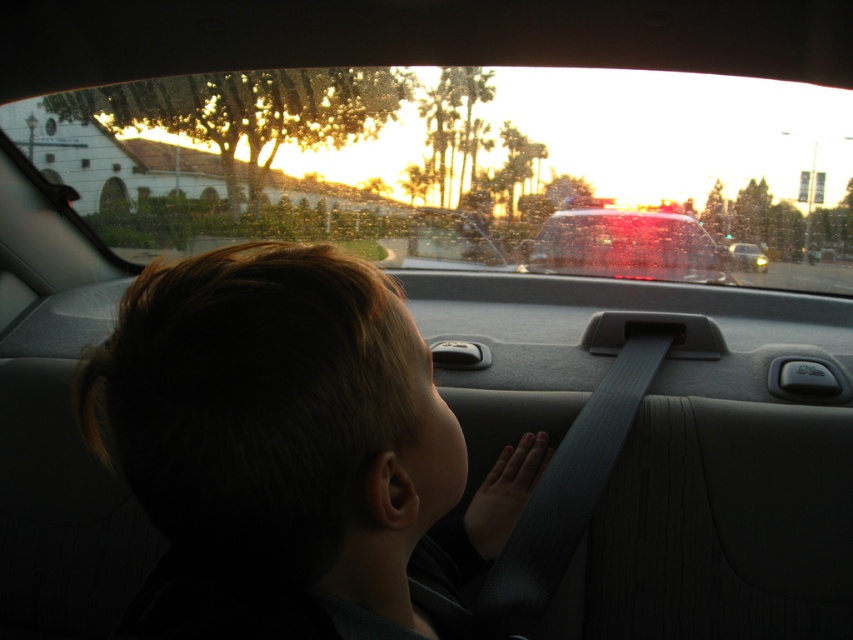
You are a passenger in the car and want to see the sunset outside through the transparent glass car window at upper center without moving your head. However, there is dark hair at center in your way. Can you adjust your position to look around it?

The transparent glass car window at upper center is further to the viewer than dark hair at center, so you can adjust your position to look around the dark hair at center and still see the sunset outside through the window.

You are a passenger in the car and want to see the sunset outside through the transparent glass car window at upper center. However, your dark hair at center is blocking your view. Can you adjust your position to see the sunset without moving your head?

The transparent glass car window at upper center is positioned over the dark hair at center. Since the window is above the hair, you can lower your head slightly to look over the dark hair at center and see the sunset through the transparent glass car window at upper center.